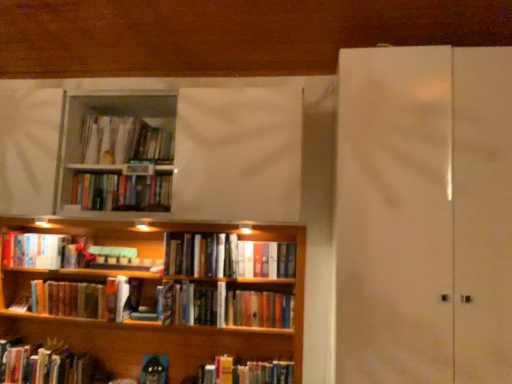
In order to click on free space above hardcover books at upper center, which is the first book in top-to-bottom order (from a real-world perspective) in this screenshot , I will do `click(113, 115)`.